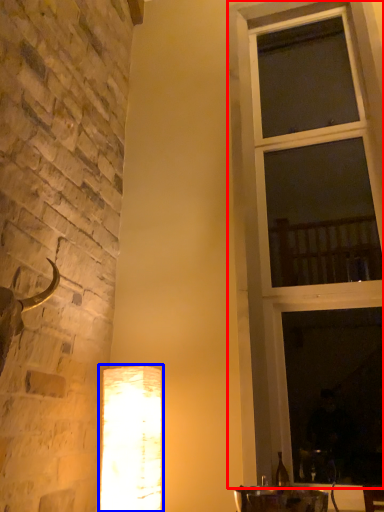
Question: Which object is further to the camera taking this photo, window (highlighted by a red box) or lamp (highlighted by a blue box)?

Choices:
 (A) window
 (B) lamp

Answer: (A)